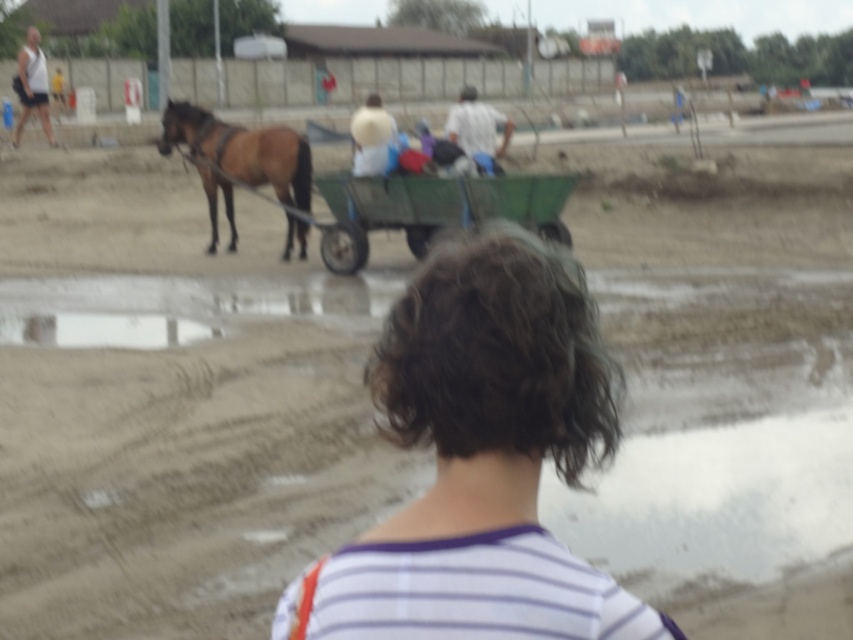
Question: Which of the following is the closest to the observer?

Choices:
 (A) (498, 301)
 (B) (15, 84)
 (C) (479, 120)

Answer: (A)

Question: Based on their relative distances, which object is nearer to the curly hair at center?

Choices:
 (A) green wooden wagon at center
 (B) white cotton shirt at center
 (C) white fabric hat at center
 (D) white tank top at upper left

Answer: (A)

Question: Can you confirm if green wooden wagon at center is bigger than white cotton shirt at center?

Choices:
 (A) no
 (B) yes

Answer: (A)

Question: Is curly hair at center above white cotton shirt at center?

Choices:
 (A) yes
 (B) no

Answer: (B)

Question: Which object is closer to the camera taking this photo?

Choices:
 (A) white fabric hat at center
 (B) curly hair at center

Answer: (B)

Question: Can you confirm if curly hair at center is thinner than white cotton shirt at center?

Choices:
 (A) yes
 (B) no

Answer: (A)